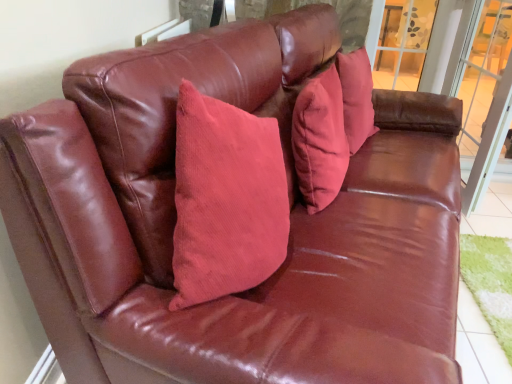
Question: Considering the positions of clear glass window at upper right and transparent glass screen door at right in the image, is clear glass window at upper right bigger or smaller than transparent glass screen door at right?

Choices:
 (A) big
 (B) small

Answer: (A)

Question: Looking at their shapes, would you say clear glass window at upper right is wider or thinner than transparent glass screen door at right?

Choices:
 (A) thin
 (B) wide

Answer: (B)

Question: Which of these objects is positioned farthest from the transparent glass screen door at right?

Choices:
 (A) corduroy pillow at center
 (B) clear glass window at upper right

Answer: (A)

Question: Estimate the real-world distances between objects in this image. Which object is farther from the clear glass window at upper right?

Choices:
 (A) transparent glass screen door at right
 (B) corduroy pillow at center

Answer: (B)